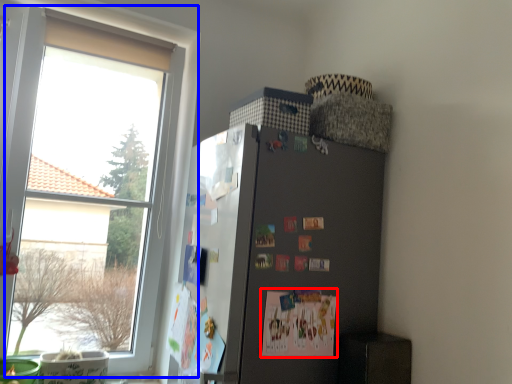
Question: Which object is further to the camera taking this photo, postcard (highlighted by a red box) or window (highlighted by a blue box)?

Choices:
 (A) postcard
 (B) window

Answer: (B)